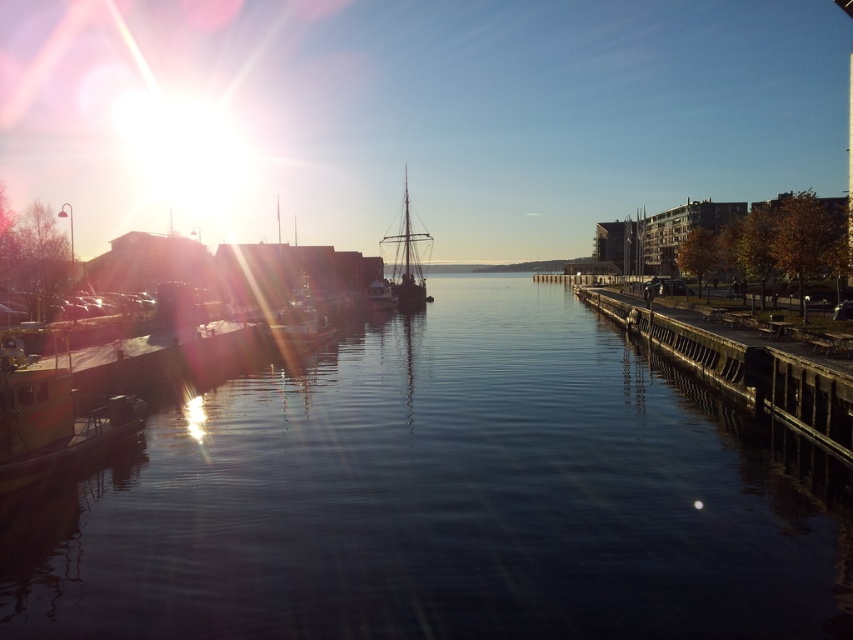
Question: Which point appears farthest from the camera in this image?

Choices:
 (A) (550, 515)
 (B) (416, 285)

Answer: (B)

Question: Which point appears closest to the camera in this image?

Choices:
 (A) (639, 332)
 (B) (576, 426)
 (C) (421, 301)

Answer: (B)

Question: Is dark water at center to the left of silhouetted wooden ship at center from the viewer's perspective?

Choices:
 (A) no
 (B) yes

Answer: (A)

Question: Is dark gray concrete dock at center behind silhouetted wooden ship at center?

Choices:
 (A) yes
 (B) no

Answer: (B)

Question: Observing the image, what is the correct spatial positioning of dark water at center in reference to dark gray concrete dock at center?

Choices:
 (A) above
 (B) below

Answer: (B)

Question: Among these objects, which one is farthest from the camera?

Choices:
 (A) dark water at center
 (B) silhouetted wooden ship at center
 (C) dark gray concrete dock at center

Answer: (B)